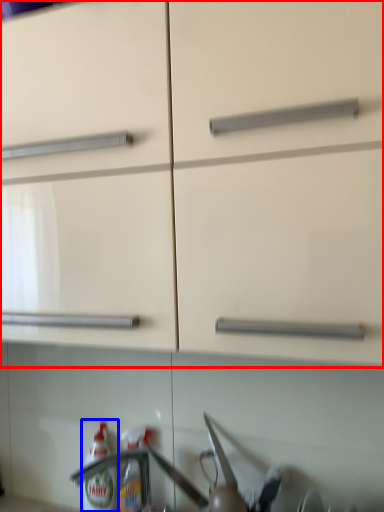
Question: Which object appears farthest to the camera in this image, cabinetry (highlighted by a red box) or bottle (highlighted by a blue box)?

Choices:
 (A) cabinetry
 (B) bottle

Answer: (B)